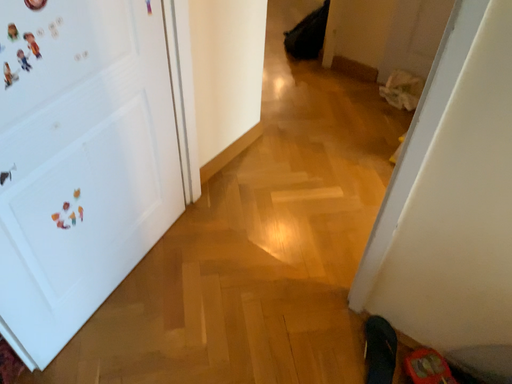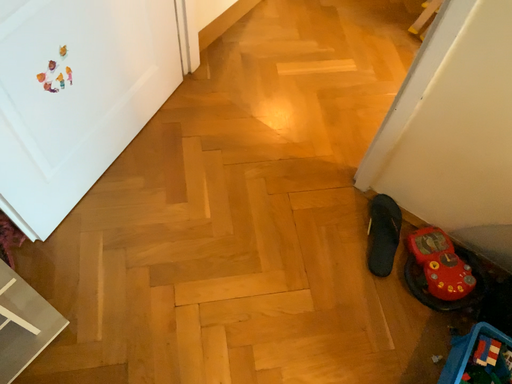
Question: Which way did the camera rotate in the video?

Choices:
 (A) rotated upward
 (B) rotated downward

Answer: (B)